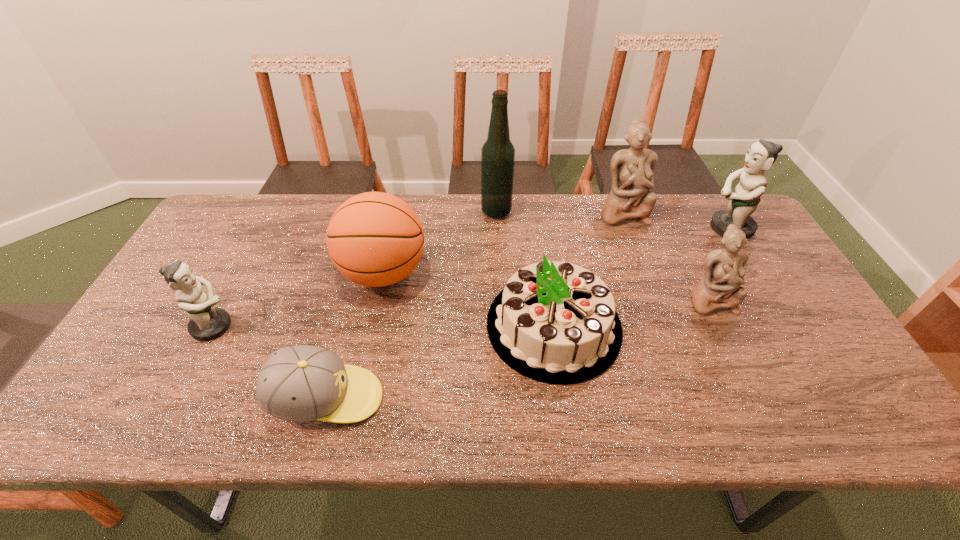
This screenshot has height=540, width=960. I want to click on the leftmost object, so click(207, 322).

Where is `the nearer green figurine`? The width and height of the screenshot is (960, 540). the nearer green figurine is located at coordinates pyautogui.click(x=207, y=322).

This screenshot has height=540, width=960. In order to click on the shortest object in this screenshot , I will do `click(303, 383)`.

I want to click on yellow baseball cap, so click(303, 383).

Image resolution: width=960 pixels, height=540 pixels. In order to click on vacant space located on the front of the tallest object in this screenshot , I will do `click(498, 261)`.

At what (x,y) coordinates should I click in order to perform the action: click on vacant space located 0.110m on the front-facing side of the farther white figurine. Please return your answer as a coordinate pair (x, y). Looking at the image, I should click on (636, 251).

Locate an element on the screen. vacant point located on the front-facing side of the farther green figurine is located at coordinates coord(627,228).

Identify the location of vacant space located on the front-facing side of the farther green figurine. Image resolution: width=960 pixels, height=540 pixels. (667, 228).

In order to click on vacant space located 0.100m on the front-facing side of the farther green figurine in this screenshot , I will do `click(673, 228)`.

Where is `free region located 0.240m on the front of the basketball`? free region located 0.240m on the front of the basketball is located at coordinates [360, 386].